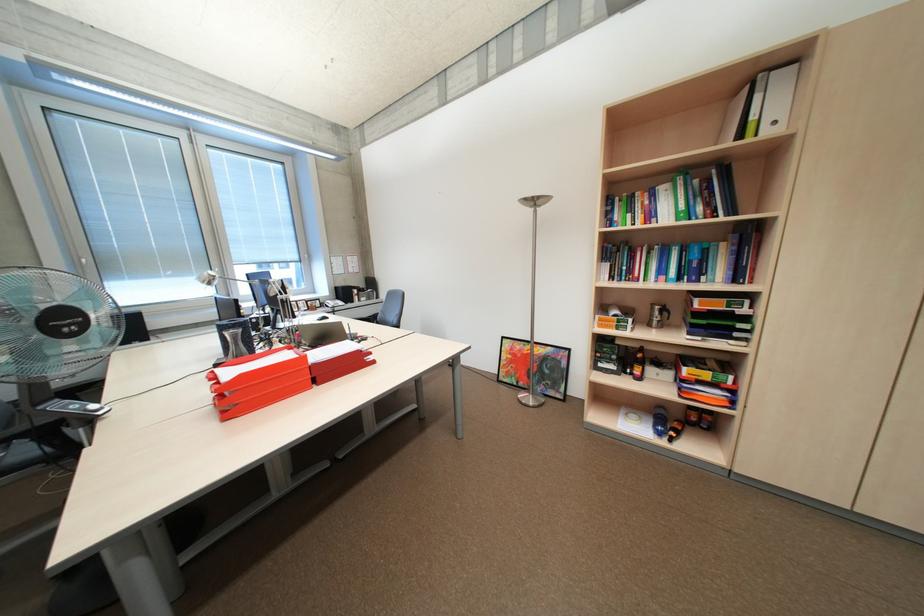
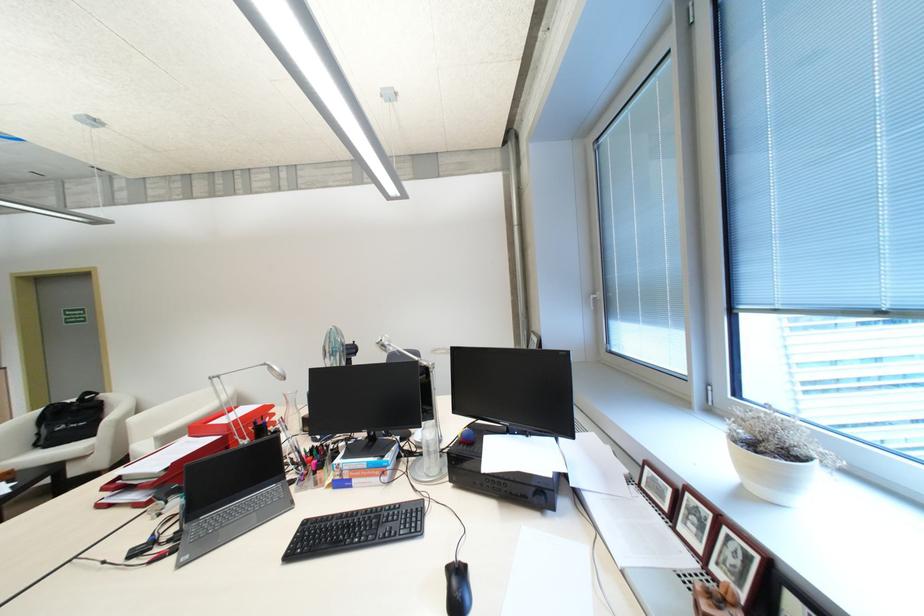
Question: I am providing you with two images of the same scene from different viewpoints. Please identify which objects are invisible in image2.

Choices:
 (A) glass water carafe
 (B) fan control button
 (C) silver appliance lid
 (D) black receiver knob

Answer: (B)